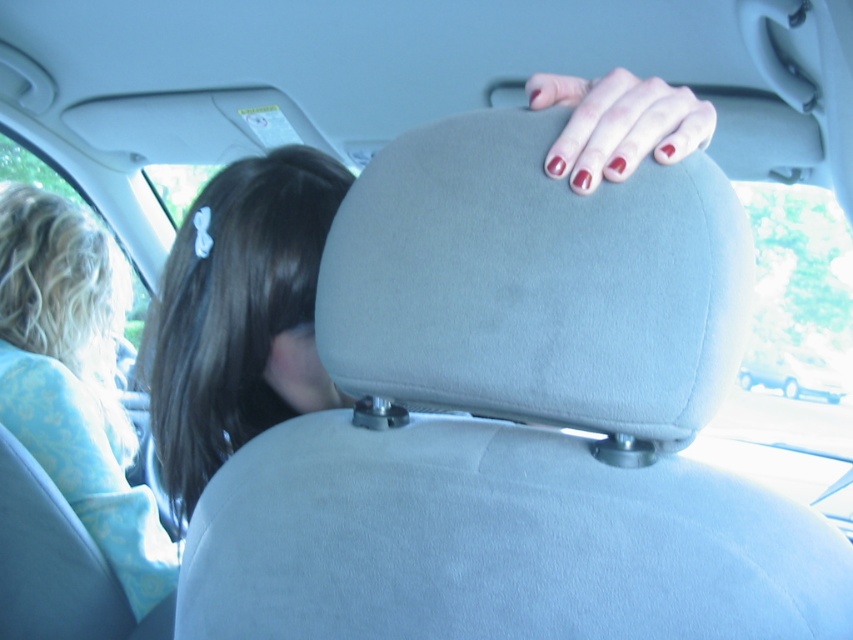
You are a passenger in the car and notice the matte red nails at upper center and the white matte van at upper center. Which object is closer to you from your current viewpoint?

The matte red nails at upper center are closer to you because they are positioned over the white matte van at upper center, indicating they are in a forward layer within the car.

You are a passenger in the car and want to check if the person in the driver seat has long hair. You see the blonde hair at left and the matte red nails at upper center. Which object is located higher in the image?

The matte red nails at upper center are located higher than the blonde hair at left in the image.

You are sitting in the backseat of the car and want to look at two points marked in the image. The first point is at coordinates point [285,346] and the second point is at point [544,90]. From your perspective, which point is closer to you?

Point [544,90] is closer to you because it is in front of point [285,346].